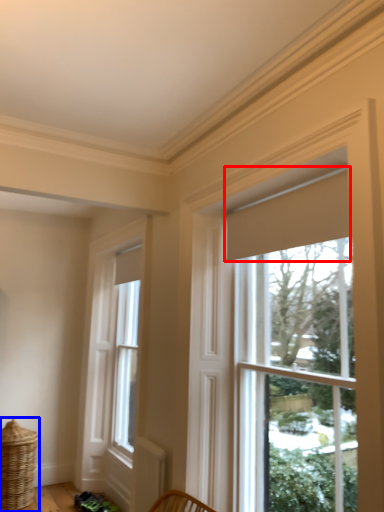
Question: Among these objects, which one is farthest to the camera, curtain (highlighted by a red box) or basket (highlighted by a blue box)?

Choices:
 (A) curtain
 (B) basket

Answer: (B)